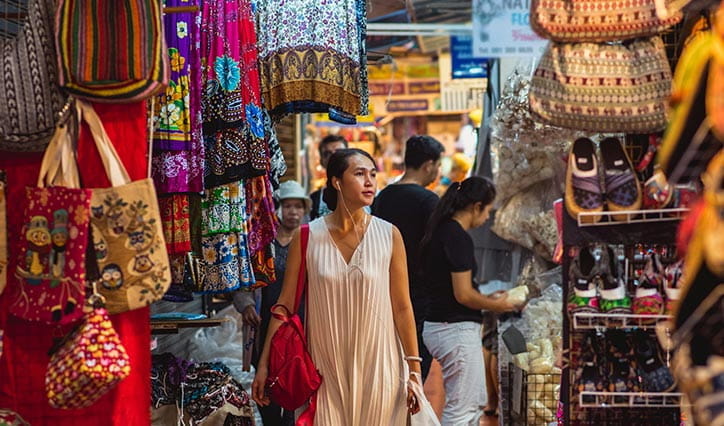
Locate an element on the screen. earpiece of a headset inside the woman's ear is located at coordinates (340, 187).